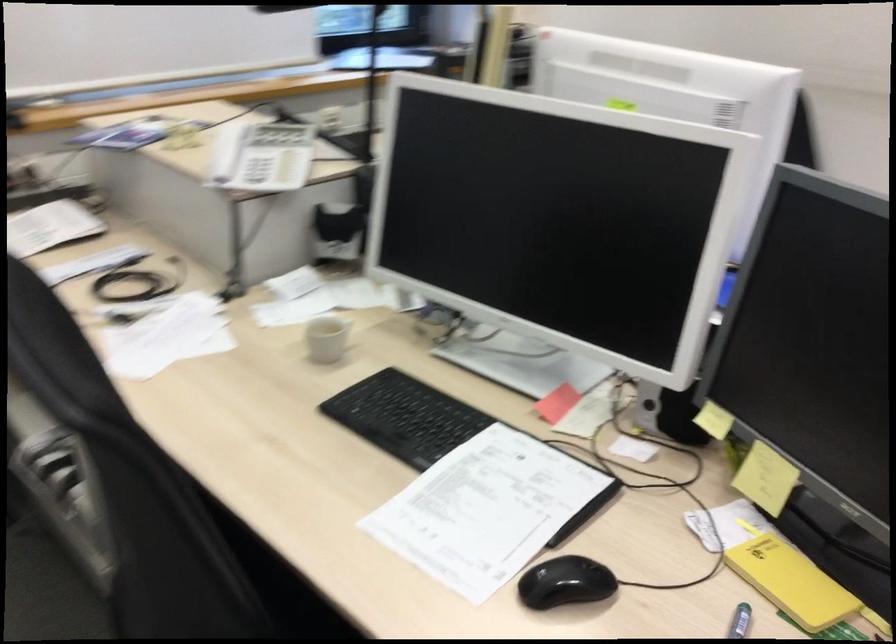
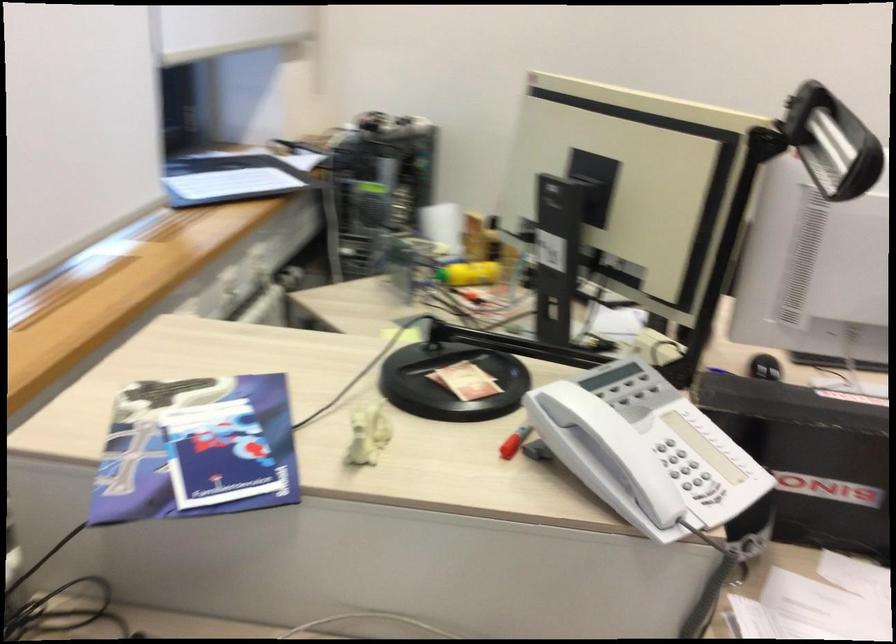
In the second image, find the point that corresponds to [176,138] in the first image.

(367, 433)